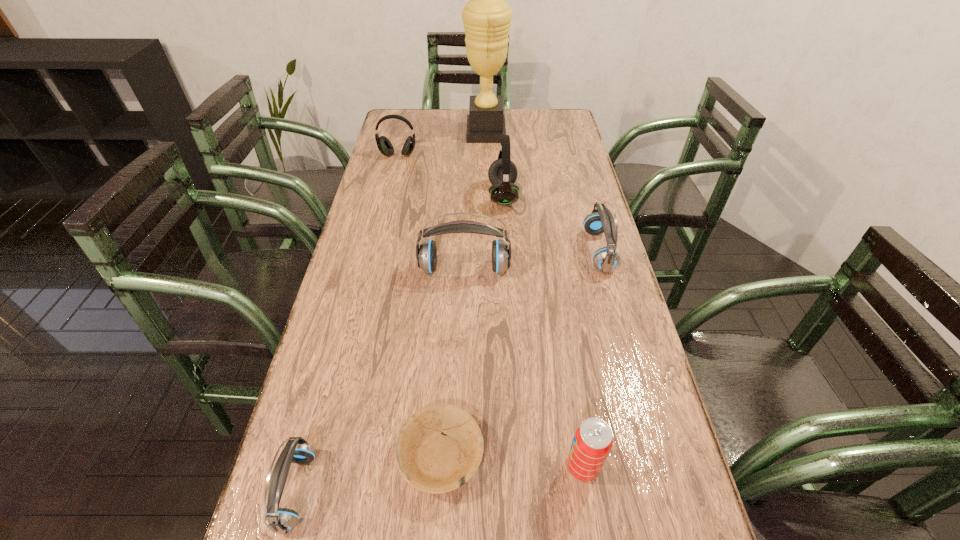
Locate an element on the screen. This screenshot has height=540, width=960. empty space between the yellow trophy cup and the biggest blue headset is located at coordinates (475, 201).

The image size is (960, 540). Find the location of `unoccupied area between the seventh object from left to right and the biggest blue headset`. unoccupied area between the seventh object from left to right and the biggest blue headset is located at coordinates (523, 368).

You are a GUI agent. You are given a task and a screenshot of the screen. Output one action in this format:
    pyautogui.click(x=<x>, y=<y>)
    Task: Click on the free area in between the biggest blue headset and the shortest headset
    The height and width of the screenshot is (540, 960).
    Given the screenshot: What is the action you would take?
    pyautogui.click(x=380, y=380)

Identify which object is the third nearest to the second blue headset from left to right. Please provide its 2D coordinates. Your answer should be formatted as a tuple, i.e. [(x, y)], where the tuple contains the x and y coordinates of a point satisfying the conditions above.

[(432, 462)]

Locate an element on the screen. object that stands as the second closest to the bowl is located at coordinates (593, 440).

Image resolution: width=960 pixels, height=540 pixels. Find the location of `the closest headset to the smaller black headset`. the closest headset to the smaller black headset is located at coordinates (502, 173).

Identify which headset is the third nearest to the left black headset. Please provide its 2D coordinates. Your answer should be formatted as a tuple, i.e. [(x, y)], where the tuple contains the x and y coordinates of a point satisfying the conditions above.

[(601, 220)]

Locate which blue headset is the closest to the nearer black headset. Please provide its 2D coordinates. Your answer should be formatted as a tuple, i.e. [(x, y)], where the tuple contains the x and y coordinates of a point satisfying the conditions above.

[(601, 220)]

At what (x,y) coordinates should I click in order to perform the action: click on blue headset that is the second nearest to the rightmost object. Please return your answer as a coordinate pair (x, y). The height and width of the screenshot is (540, 960). Looking at the image, I should click on (279, 520).

Find the location of a particular element. free location that satisfies the following two spatial constraints: 1. on the ear cups of the biggest blue headset; 2. on the ear cups of the nearest headset is located at coordinates (457, 490).